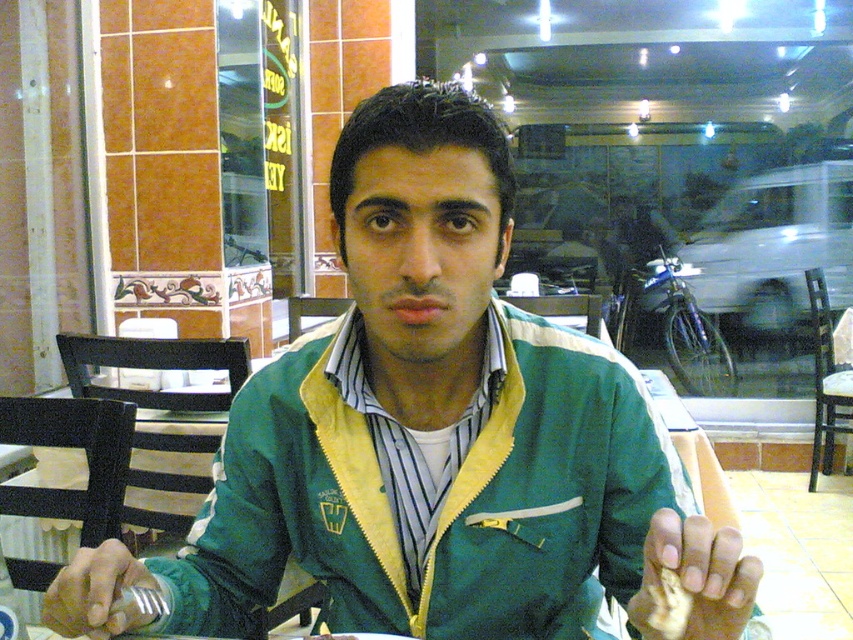
Who is shorter, green/yellow fabric jacket at center or yellowish matte bread at center?

yellowish matte bread at center is shorter.

Is green/yellow fabric jacket at center behind yellowish matte bread at center?

That is True.

Locate an element on the screen. The image size is (853, 640). green/yellow fabric jacket at center is located at coordinates (437, 500).

I want to click on green/yellow fabric jacket at center, so click(x=437, y=500).

Is green/yellow jacket at center shorter than green/yellow fabric jacket at center?

No.

Is point (408, 524) behind point (306, 435)?

No, it is not.

Locate an element on the screen. green/yellow jacket at center is located at coordinates (430, 436).

Locate an element on the screen. The height and width of the screenshot is (640, 853). green/yellow jacket at center is located at coordinates (430, 436).

Can you confirm if green/yellow jacket at center is thinner than yellowish matte bread at center?

In fact, green/yellow jacket at center might be wider than yellowish matte bread at center.

Between green/yellow jacket at center and yellowish matte bread at center, which one is positioned lower?

yellowish matte bread at center is lower down.

Is point (643, 531) closer to camera compared to point (659, 632)?

That is False.

This screenshot has height=640, width=853. In order to click on green/yellow jacket at center in this screenshot , I will do `click(430, 436)`.